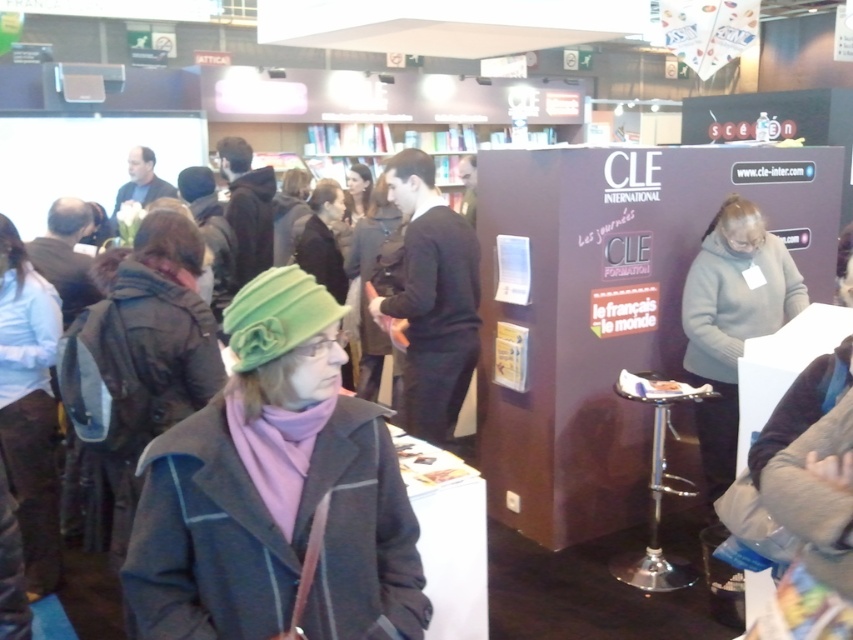
Question: Which is nearer to the green woolen hat at center?

Choices:
 (A) light brown fabric coat at left
 (B) gray fuzzy sweater at right
 (C) green felt hat at center
 (D) matte black jacket at center

Answer: (D)

Question: Can you confirm if green felt hat at center is positioned below light brown fabric coat at left?

Choices:
 (A) yes
 (B) no

Answer: (B)

Question: Is green felt hat at center thinner than matte black jacket at center?

Choices:
 (A) no
 (B) yes

Answer: (A)

Question: Does green felt hat at center come behind matte black jacket at center?

Choices:
 (A) no
 (B) yes

Answer: (A)

Question: Which point is farther to the camera?

Choices:
 (A) (254, 296)
 (B) (280, 211)
 (C) (369, 316)

Answer: (B)

Question: Estimate the real-world distances between objects in this image. Which object is closer to the gray fuzzy sweater at right?

Choices:
 (A) green felt hat at center
 (B) green woolen hat at center
 (C) matte black jacket at center
 (D) light brown fabric coat at left

Answer: (B)